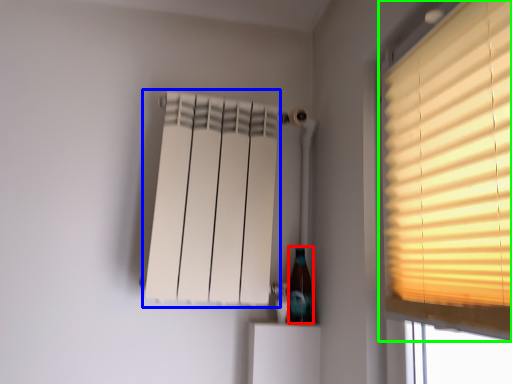
Question: Which object is the farthest from bottle (highlighted by a red box)? Choose among these: curtain (highlighted by a blue box) or window (highlighted by a green box).

Choices:
 (A) curtain
 (B) window

Answer: (B)